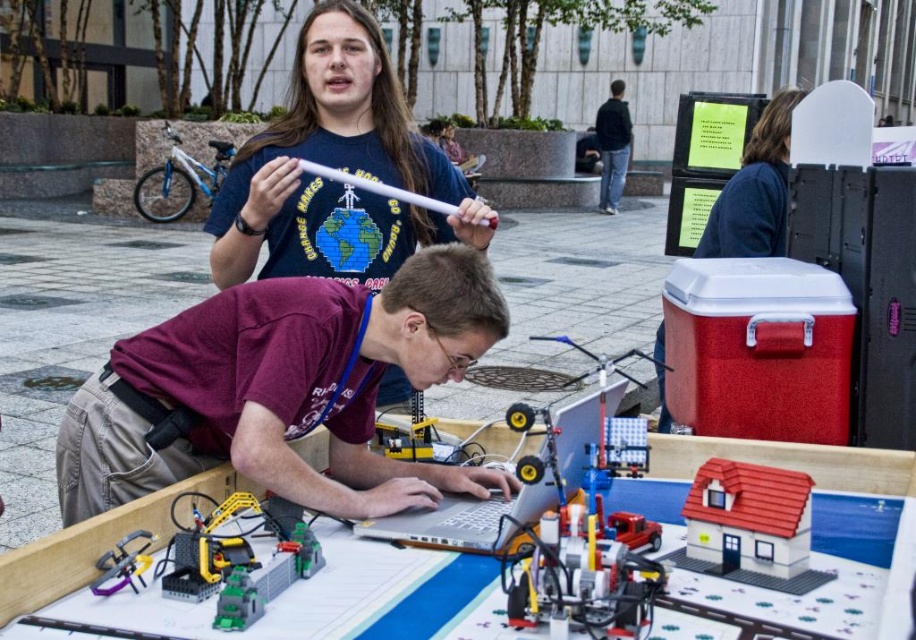
You are a visitor at this LEGO exhibition and want to place a small notebook between the plastic toy house at center and the silver metallic laptop at center. Based on their positions, which side of the laptop should you place the notebook to ensure it is between them?

The plastic toy house at center is positioned on the right side of the silver metallic laptop at center, so placing the notebook to the right of the laptop would place it between the two objects.

You are a photographer setting up a tripod to capture the dark blue jeans at center and the metallic silver wrench at lower left. To ensure both are in frame, should you adjust the tripod to the left or right?

The dark blue jeans at center is positioned on the right side of the metallic silver wrench at lower left, so adjusting the tripod to the left would bring both into frame.